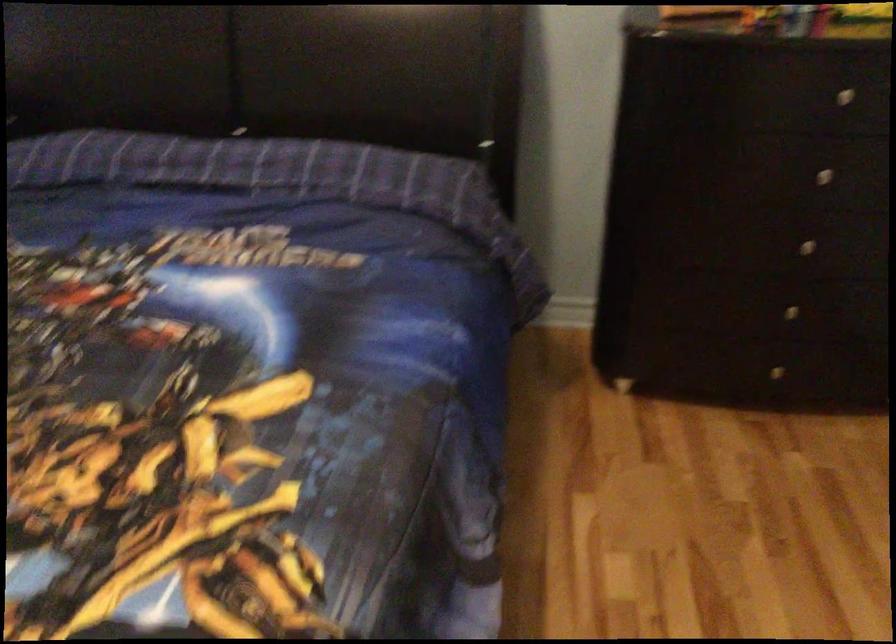
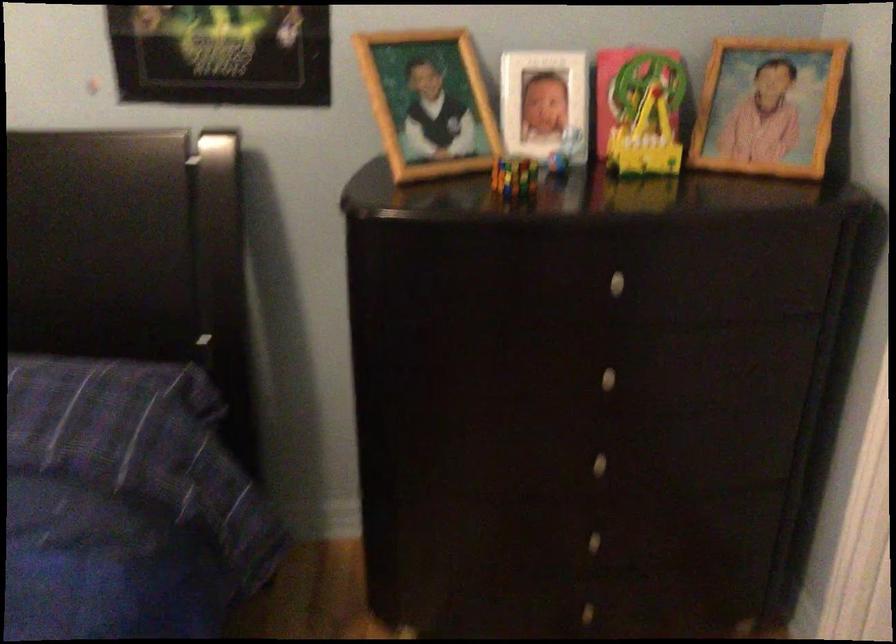
In a continuous first-person perspective shot, in which direction is the camera moving?

The movement direction of the cameraman is right, forward.